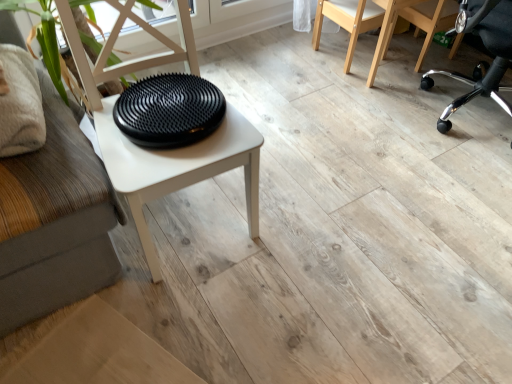
Question: Considering the relative sizes of black rubberized disc at center and natural wood chair at upper right, arranged as the first chair when viewed from the left, in the image provided, is black rubberized disc at center bigger than natural wood chair at upper right, arranged as the first chair when viewed from the left,?

Choices:
 (A) no
 (B) yes

Answer: (A)

Question: Is black rubberized disc at center taller than natural wood chair at upper right, arranged as the first chair when viewed from the left?

Choices:
 (A) yes
 (B) no

Answer: (B)

Question: Is the position of black rubberized disc at center less distant than that of natural wood chair at upper right, arranged as the first chair when viewed from the left?

Choices:
 (A) no
 (B) yes

Answer: (B)

Question: Is black rubberized disc at center placed right next to natural wood chair at upper right, the third chair from the right?

Choices:
 (A) no
 (B) yes

Answer: (A)

Question: Is black rubberized disc at center looking in the opposite direction of natural wood chair at upper right, arranged as the first chair when viewed from the left?

Choices:
 (A) no
 (B) yes

Answer: (A)

Question: Choose the correct answer: Is black rubberized disc at center inside black plastic office chair at right, the first chair viewed from the right, or outside it?

Choices:
 (A) inside
 (B) outside

Answer: (B)

Question: Considering the positions of black rubberized disc at center and black plastic office chair at right, which is the 3th chair in left-to-right order, in the image, is black rubberized disc at center bigger or smaller than black plastic office chair at right, which is the 3th chair in left-to-right order,?

Choices:
 (A) small
 (B) big

Answer: (A)

Question: Considering the relative positions of black rubberized disc at center and black plastic office chair at right, which is the 3th chair in left-to-right order, in the image provided, is black rubberized disc at center to the left or to the right of black plastic office chair at right, which is the 3th chair in left-to-right order,?

Choices:
 (A) left
 (B) right

Answer: (A)

Question: From the image's perspective, relative to black plastic office chair at right, which is the 3th chair in left-to-right order, is black rubberized disc at center above or below?

Choices:
 (A) below
 (B) above

Answer: (A)

Question: Considering the positions of point (189, 92) and point (353, 8), is point (189, 92) closer or farther from the camera than point (353, 8)?

Choices:
 (A) farther
 (B) closer

Answer: (B)

Question: In terms of width, does black rubberized disc at center look wider or thinner when compared to natural wood chair at upper right, arranged as the first chair when viewed from the left?

Choices:
 (A) wide
 (B) thin

Answer: (A)

Question: In the image, is black rubberized disc at center positioned in front of or behind natural wood chair at upper right, arranged as the first chair when viewed from the left?

Choices:
 (A) behind
 (B) front

Answer: (B)

Question: Do you think black rubberized disc at center is within natural wood chair at upper right, arranged as the first chair when viewed from the left, or outside of it?

Choices:
 (A) inside
 (B) outside

Answer: (B)

Question: From a real-world perspective, is natural wood chair at upper right, arranged as the first chair when viewed from the left, physically located above or below black rubberized disc at center?

Choices:
 (A) below
 (B) above

Answer: (A)

Question: In terms of height, does natural wood chair at upper right, the third chair from the right, look taller or shorter compared to black rubberized disc at center?

Choices:
 (A) short
 (B) tall

Answer: (B)